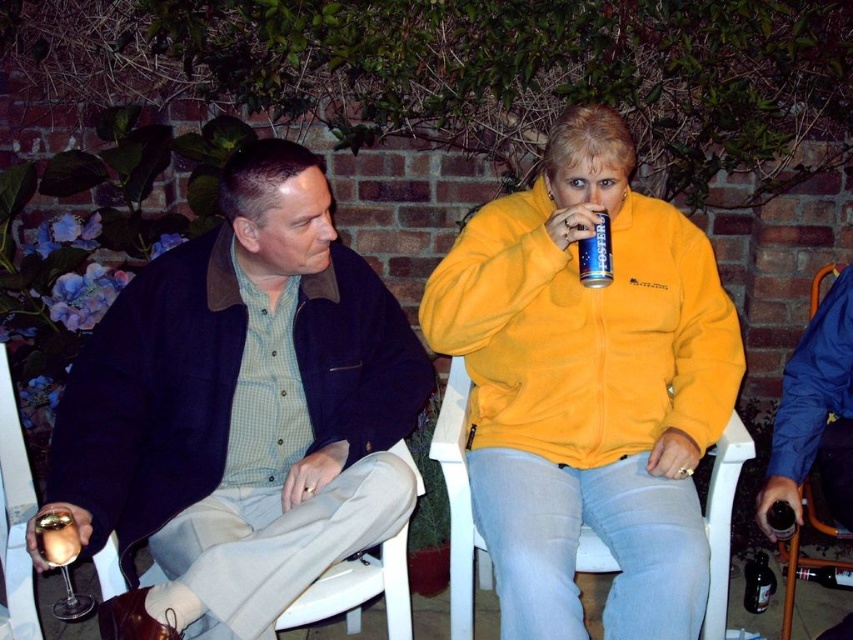
You are standing in the outdoor gathering area and need to locate two specific points marked in the image. Which point, point (177, 547) or point (830, 432), is physically closer to you?

Point (177, 547) is closer to the viewer than point (830, 432).

You are standing at the center of the image. Which direction should you move to reach the orange plastic chair at lower right?

The orange plastic chair at lower right is located at point (815, 413), so you should move towards the lower right direction to reach it.

You are a photographer standing at the center of the scene. You want to capture a photo that includes both the orange plastic chair at lower right and the metallic gold ring at lower left. What is the minimum distance you need to move backward to ensure both objects are in frame?

The minimum distance you need to move backward is 1.48 meters to ensure both the orange plastic chair at lower right and the metallic gold ring at lower left are in frame.